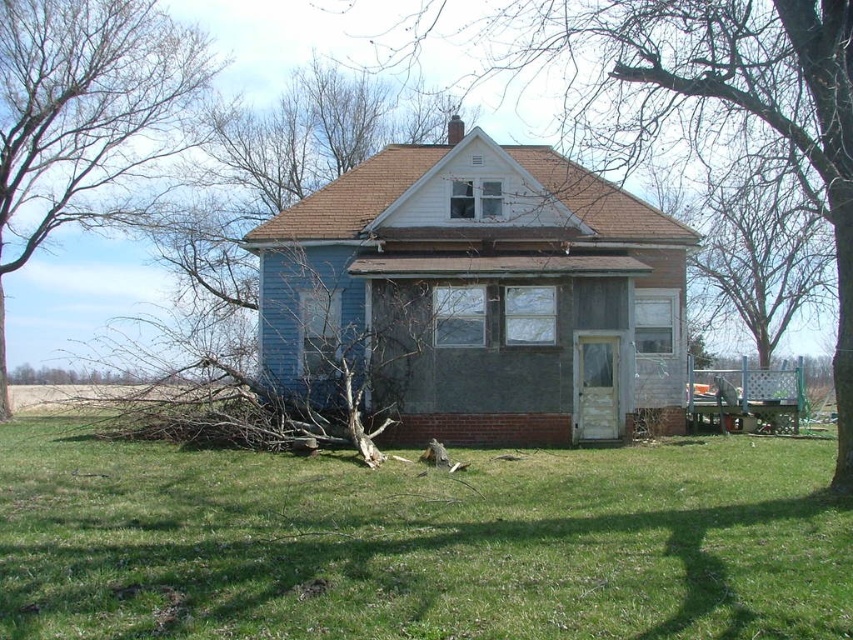
Question: Which of the following is the closest to the observer?

Choices:
 (A) (64, 152)
 (B) (817, 168)

Answer: (B)

Question: Can you confirm if green grass at lower center is thinner than bare branches at left?

Choices:
 (A) no
 (B) yes

Answer: (A)

Question: Which object is the farthest from the green grass at lower center?

Choices:
 (A) gray bark tree at center
 (B) bare branches at left

Answer: (B)

Question: Which object is farther from the camera taking this photo?

Choices:
 (A) gray bark tree at center
 (B) bare branches at left

Answer: (B)

Question: Does green grass at lower center appear on the right side of gray bark tree at center?

Choices:
 (A) no
 (B) yes

Answer: (A)

Question: Is green grass at lower center to the right of gray bark tree at center from the viewer's perspective?

Choices:
 (A) yes
 (B) no

Answer: (B)